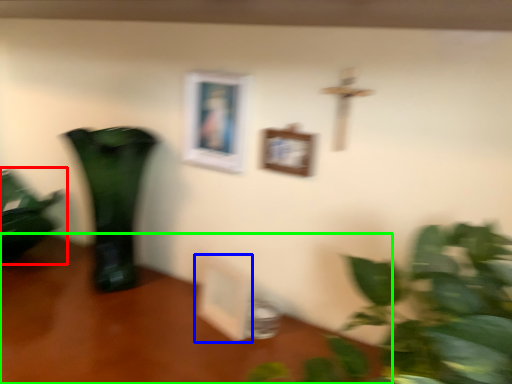
Question: Which object is the farthest from houseplant (highlighted by a red box)? Choose among these: picture frame (highlighted by a blue box) or table (highlighted by a green box).

Choices:
 (A) picture frame
 (B) table

Answer: (A)